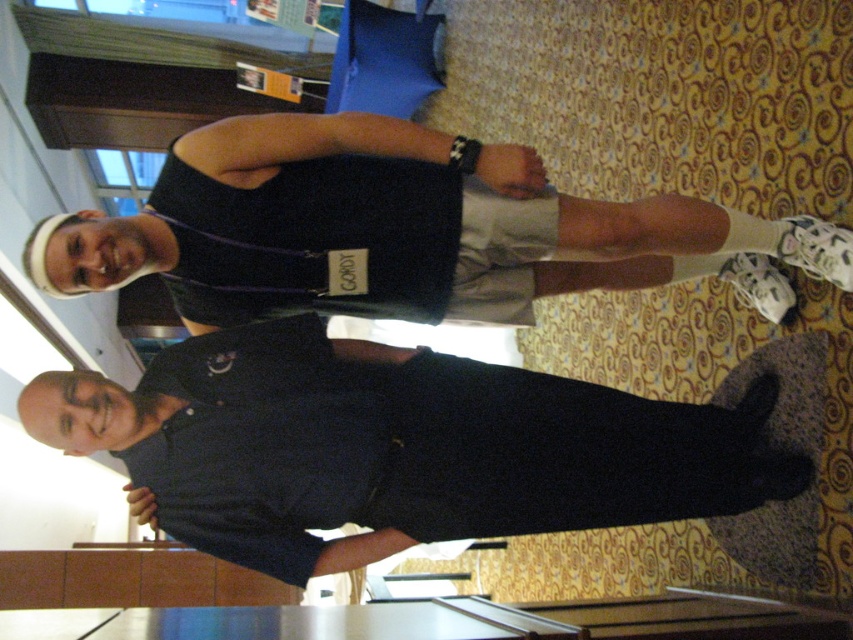
Question: Which point is closer to the camera?

Choices:
 (A) black smooth shirt at center
 (B) black fabric tank top at upper center

Answer: (A)

Question: In this image, where is black smooth shirt at center located relative to black fabric tank top at upper center?

Choices:
 (A) above
 (B) below

Answer: (B)

Question: Observing the image, what is the correct spatial positioning of black smooth shirt at center in reference to black fabric tank top at upper center?

Choices:
 (A) below
 (B) above

Answer: (A)

Question: Which of the following is the farthest from the observer?

Choices:
 (A) black fabric tank top at upper center
 (B) black smooth shirt at center

Answer: (A)

Question: Which point is farther from the camera taking this photo?

Choices:
 (A) (700, 204)
 (B) (200, 449)

Answer: (A)

Question: Observing the image, what is the correct spatial positioning of black smooth shirt at center in reference to black fabric tank top at upper center?

Choices:
 (A) right
 (B) left

Answer: (B)